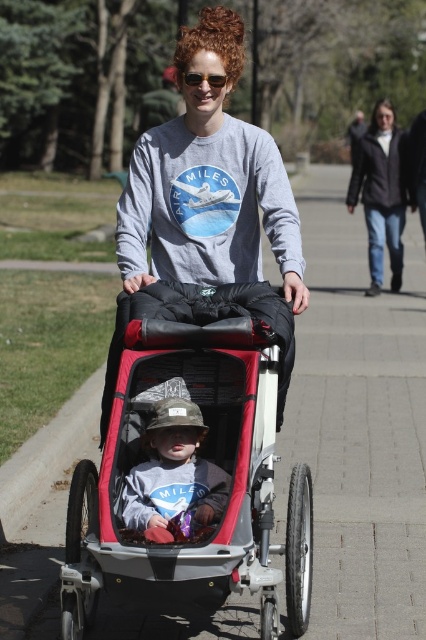
You are standing in the park and want to reach the point marked at coordinates [198,464]. If you can walk 3 feet per second, how many seconds will it take you to reach that point?

The distance between you and the point marked at coordinates [198,464] is 15.07 feet. At a walking speed of 3 feet per second, it will take approximately 5.02 seconds to reach the point.

You are a fashion designer observing the scene in the park. You need to compare the camouflage fabric hat at center and the dark gray fleece sweatshirt at upper right. Which item has a smaller width?

The camouflage fabric hat at center is thinner than the dark gray fleece sweatshirt at upper right, so the camouflage fabric hat at center has a smaller width.

You are a photographer trying to capture the child in the stroller. You notice two items at the center of your viewfinder, the camouflage fabric hat at center and the gold reflective sunglasses at center. Which item will appear bigger in your photo?

The camouflage fabric hat at center has a larger size compared to gold reflective sunglasses at center, so it will appear bigger in the photo.